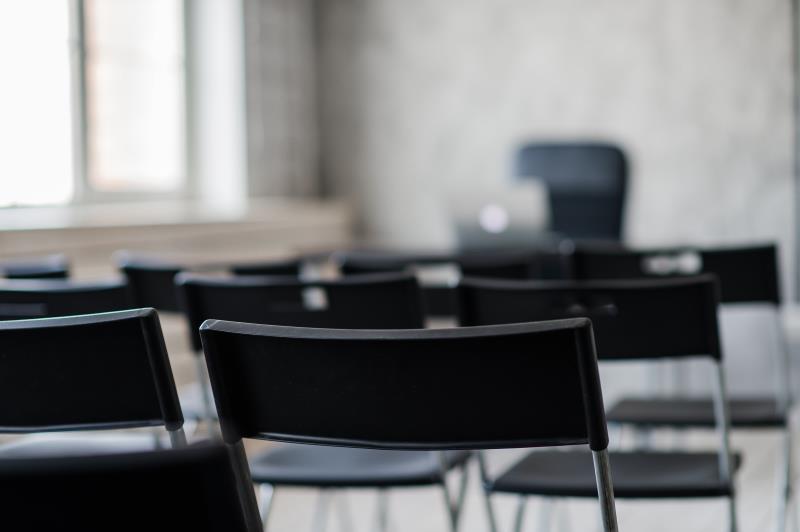
Locate an element on the screen. The width and height of the screenshot is (800, 532). chair is located at coordinates (108, 475), (88, 382), (366, 409), (608, 320), (342, 298), (114, 288), (146, 279), (376, 264), (601, 264).